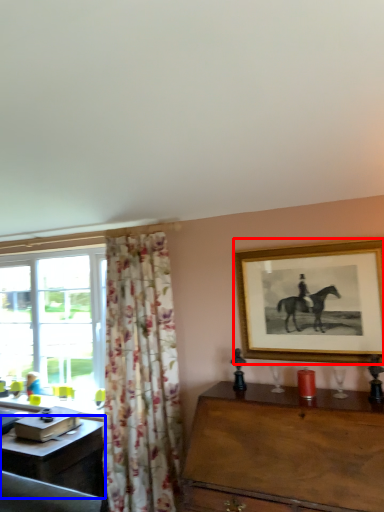
Question: Which of the following is the closest to the observer, picture frame (highlighted by a red box) or desk (highlighted by a blue box)?

Choices:
 (A) picture frame
 (B) desk

Answer: (A)